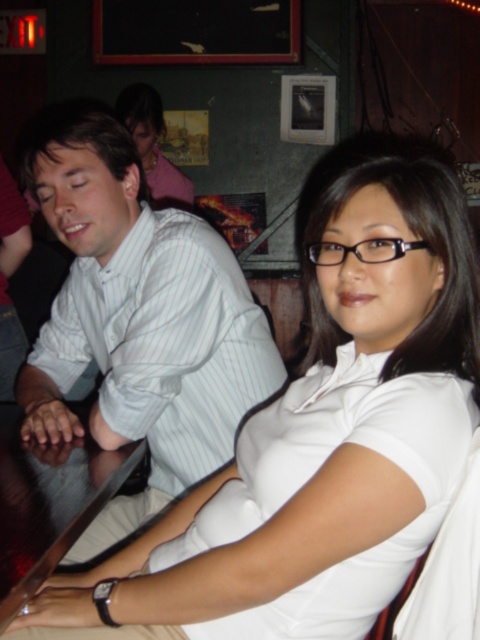
You are a delivery person standing at the entrance of the bar. You need to place a small package on the dark wood table at lower left. The delivery robot you are using has a maximum reach of 80 centimeters. Can the robot place the package on the table without moving closer?

The distance between the dark wood table at lower left and the camera is 81.98 centimeters. Since the robot can only reach 80 centimeters, it cannot place the package on the table without moving closer.

In the scene shown: You are a waiter in a restaurant. You need to deliver a drink to the customer wearing the white striped shirt at left. To avoid spilling the drink, you should walk around which side of the pink fabric at upper left?

You should walk around the side away from the white striped shirt at left since it is in front of the pink fabric at upper left, meaning the shirt is closer to you than the fabric. Walking around the opposite side of the pink fabric at upper left would keep you clear of the customer.